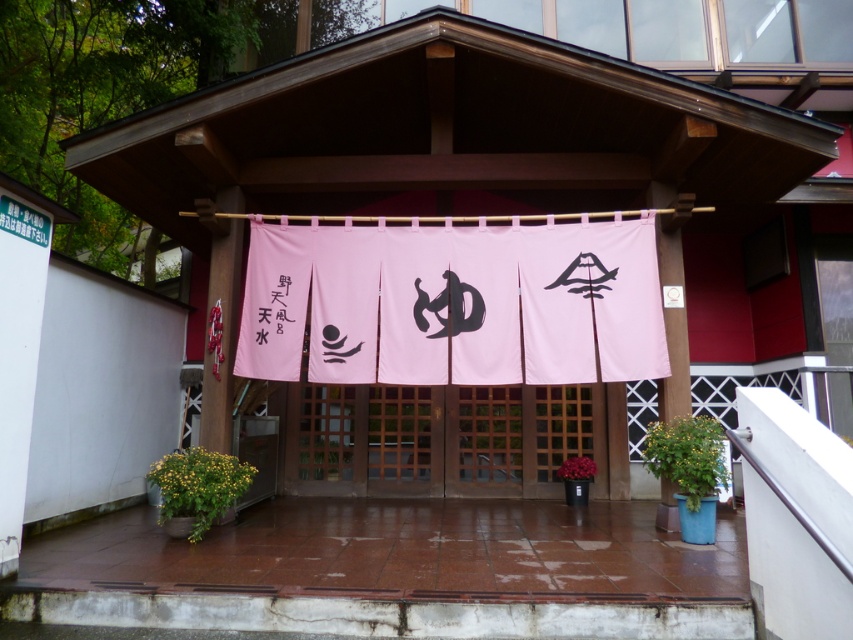
Does pink fabric banner at center appear under black paper at left?

Incorrect, pink fabric banner at center is not positioned below black paper at left.

Based on the photo, between pink fabric banner at center and black paper at left, which one is positioned lower?

black paper at left

Where is `pink fabric banner at center`? pink fabric banner at center is located at coordinates (457, 304).

Where is `pink fabric banner at center`? This screenshot has height=640, width=853. pink fabric banner at center is located at coordinates (457, 304).